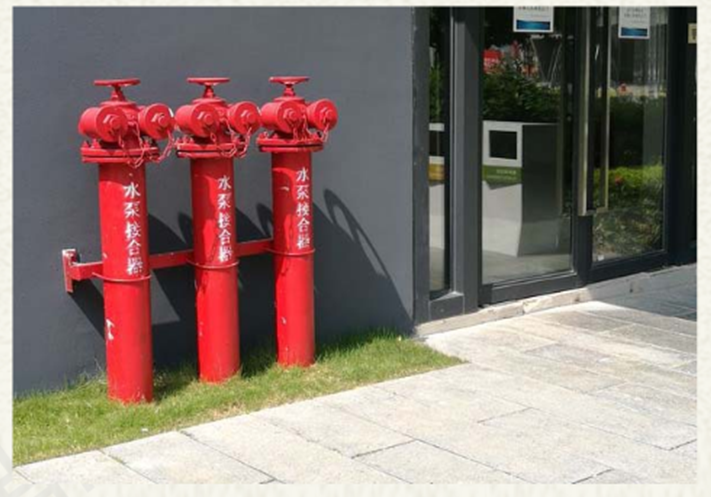
Identify the location of walk way. Image resolution: width=711 pixels, height=497 pixels. (545, 417).